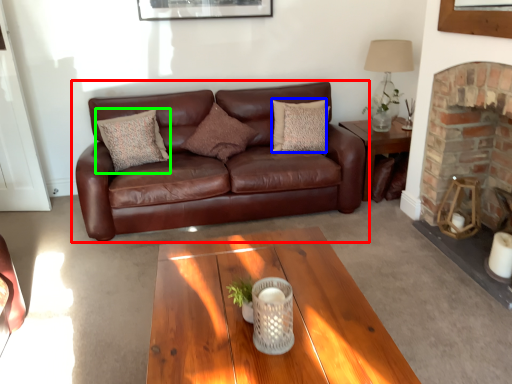
Question: Considering the real-world distances, which object is closest to studio couch (highlighted by a red box)? pillow (highlighted by a blue box) or pillow (highlighted by a green box).

Choices:
 (A) pillow
 (B) pillow

Answer: (B)